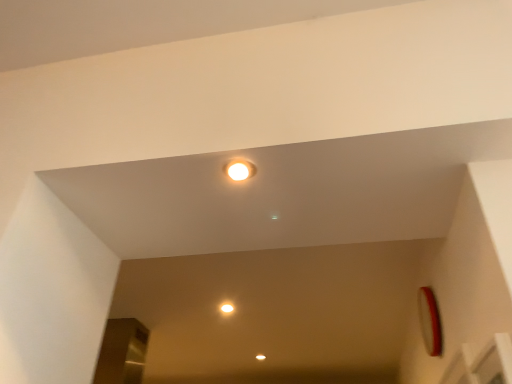
Question: Does point (230, 307) appear closer or farther from the camera than point (228, 162)?

Choices:
 (A) closer
 (B) farther

Answer: (B)

Question: From the image's perspective, is matte white light at center positioned above or below white glossy light at center?

Choices:
 (A) above
 (B) below

Answer: (B)

Question: From their relative heights in the image, would you say matte white light at center is taller or shorter than white glossy light at center?

Choices:
 (A) short
 (B) tall

Answer: (B)

Question: Would you say white glossy light at center is to the left or to the right of matte white light at center in the picture?

Choices:
 (A) right
 (B) left

Answer: (A)

Question: Is point (252, 173) positioned closer to the camera than point (226, 304)?

Choices:
 (A) farther
 (B) closer

Answer: (B)

Question: Do you think white glossy light at center is within matte white light at center, or outside of it?

Choices:
 (A) inside
 (B) outside

Answer: (B)

Question: Based on their sizes in the image, would you say white glossy light at center is bigger or smaller than matte white light at center?

Choices:
 (A) big
 (B) small

Answer: (B)